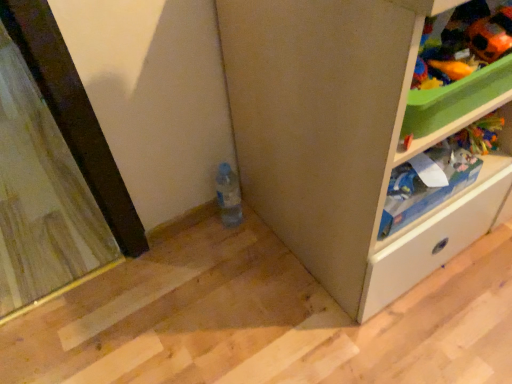
Where is `vacant area to the right of translucent plastic bottle at lower center`? The width and height of the screenshot is (512, 384). vacant area to the right of translucent plastic bottle at lower center is located at coordinates (263, 230).